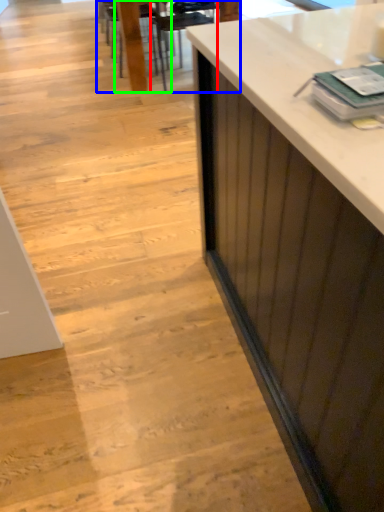
Question: Considering the real-world distances, which object is farthest from armchair (highlighted by a red box)? table (highlighted by a blue box) or chair (highlighted by a green box)?

Choices:
 (A) table
 (B) chair

Answer: (B)